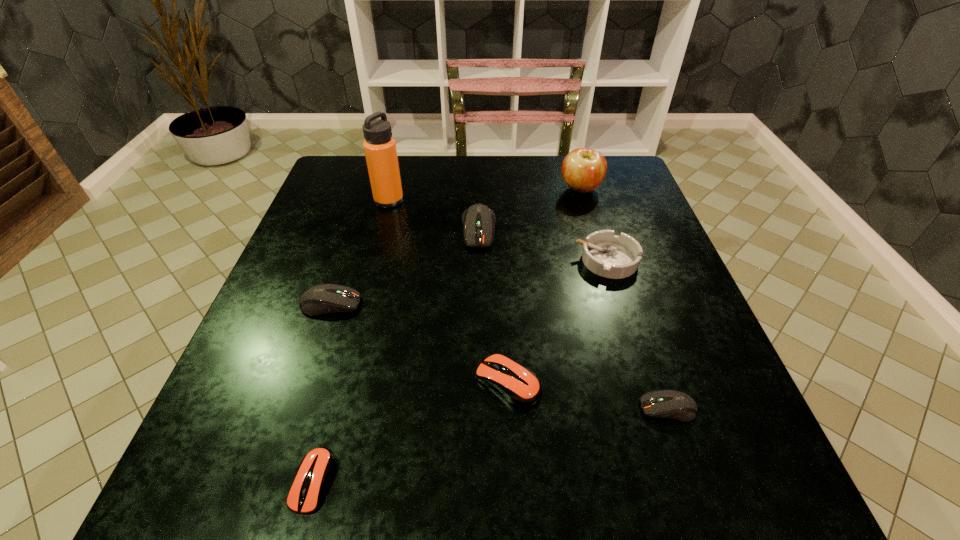
Where is `the rightmost computer mouse`? The width and height of the screenshot is (960, 540). the rightmost computer mouse is located at coordinates (673, 404).

The image size is (960, 540). In order to click on the smallest dark computer equipment in this screenshot , I will do `click(673, 404)`.

The image size is (960, 540). In order to click on the left orange computer mouse in this screenshot , I will do `click(315, 469)`.

Locate an element on the screen. The width and height of the screenshot is (960, 540). the nearest computer mouse is located at coordinates (315, 469).

You are a GUI agent. You are given a task and a screenshot of the screen. Output one action in this format:
    pyautogui.click(x=<x>, y=<y>)
    Task: Click on the free location located on the back of the thermos bottle
    Image resolution: width=960 pixels, height=540 pixels.
    Given the screenshot: What is the action you would take?
    pyautogui.click(x=396, y=173)

You are a GUI agent. You are given a task and a screenshot of the screen. Output one action in this format:
    pyautogui.click(x=<x>, y=<y>)
    Task: Click on the free space located on the front of the second tallest object
    The image size is (960, 540).
    Given the screenshot: What is the action you would take?
    pyautogui.click(x=602, y=261)

The width and height of the screenshot is (960, 540). Find the location of `vacant area situated on the button of the tallest computer mouse`. vacant area situated on the button of the tallest computer mouse is located at coordinates (478, 379).

The width and height of the screenshot is (960, 540). I want to click on vacant region located 0.130m on the back of the ashtray, so click(x=591, y=209).

This screenshot has width=960, height=540. I want to click on vacant position located 0.340m on the button of the second farthest dark computer equipment, so click(530, 304).

Identify the location of free location located 0.350m on the back of the farther orange computer mouse. (500, 235).